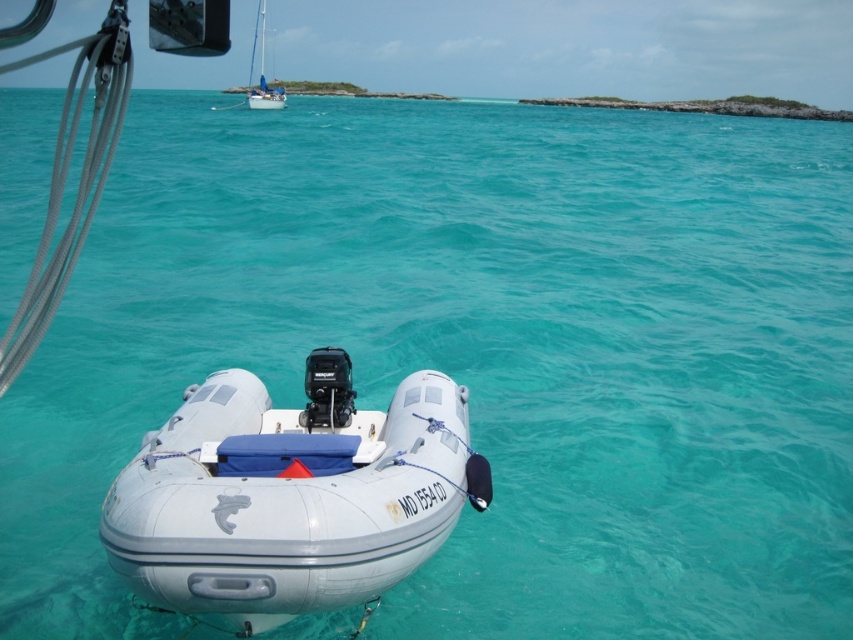
Question: Can you confirm if white rubber dinghy at center is positioned to the left of white glossy sailboat at upper center?

Choices:
 (A) yes
 (B) no

Answer: (B)

Question: Which object appears farthest from the camera in this image?

Choices:
 (A) white glossy sailboat at upper center
 (B) white rubber dinghy at center

Answer: (A)

Question: Is white rubber dinghy at center smaller than white glossy sailboat at upper center?

Choices:
 (A) no
 (B) yes

Answer: (B)

Question: Is white rubber dinghy at center further to camera compared to white glossy sailboat at upper center?

Choices:
 (A) yes
 (B) no

Answer: (B)

Question: Which point is farther to the camera?

Choices:
 (A) [x=236, y=392]
 (B) [x=256, y=17]

Answer: (B)